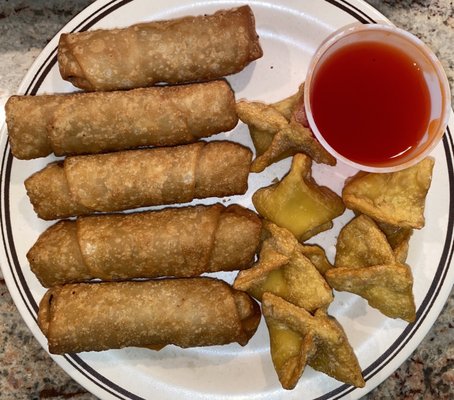
Where is `round white ceramic plate`? The image size is (454, 400). round white ceramic plate is located at coordinates pos(16,184), pos(443,172).